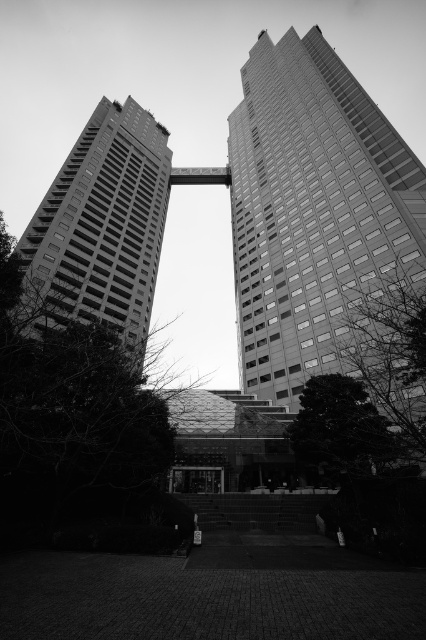
You are an architect analyzing the structural integrity of the buildings in the image. Given that the smooth glass skyscraper at center is taller than the smooth concrete building at left, which building would require more wind resistance engineering considerations?

The smooth glass skyscraper at center requires more wind resistance engineering considerations because it is taller than the smooth concrete building at left, and taller structures generally face greater wind forces.

You are standing at the point marked as point [311,209] in the image. Looking around, you see the smooth glass skyscraper at center. Which direction should you face to see the bridge connecting the two buildings?

The bridge connecting the two buildings is located at their upper levels. Since you are facing the smooth glass skyscraper at center, you should turn to face the direction where the two buildings meet to see the bridge connecting them.

You are a drone operator trying to fly a drone between the two buildings. The smooth glass skyscraper at center and the smooth concrete building at left are in your path. Based on their positions, which building should you avoid flying towards first to ensure a safe path?

The smooth concrete building at left is behind the smooth glass skyscraper at center, so you should avoid flying towards the smooth glass skyscraper at center first to ensure a safe path.